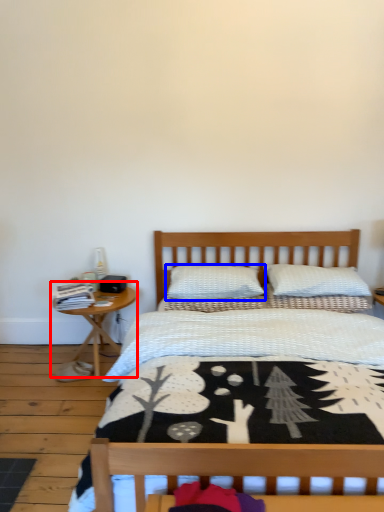
Question: Which point is further to the camera, nightstand (highlighted by a red box) or pillow (highlighted by a blue box)?

Choices:
 (A) nightstand
 (B) pillow

Answer: (B)